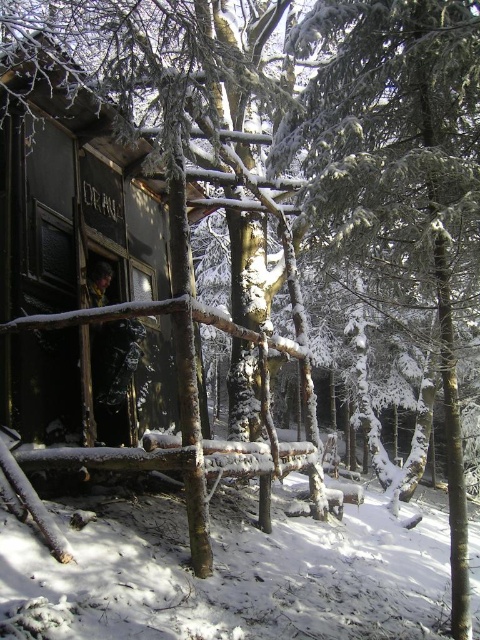
Is black wooden cabin at left wider than white fluffy snow at lower left?

No, black wooden cabin at left is not wider than white fluffy snow at lower left.

Is black wooden cabin at left thinner than white fluffy snow at lower left?

Correct, black wooden cabin at left's width is less than white fluffy snow at lower left's.

Image resolution: width=480 pixels, height=640 pixels. Identify the location of black wooden cabin at left. (71, 193).